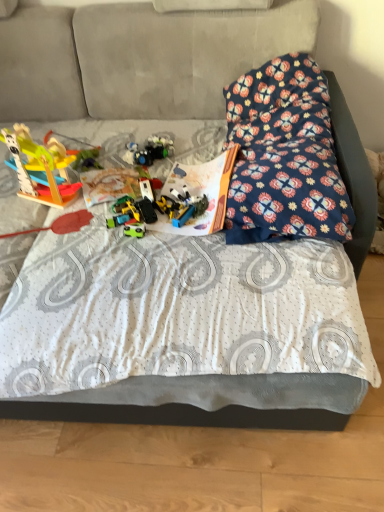
Question: Choose the correct answer: Is wooden toy at left, the first toy viewed from the left, inside plastic toy car at center, the sixth toy when ordered from left to right, or outside it?

Choices:
 (A) outside
 (B) inside

Answer: (A)

Question: Considering the positions of wooden toy at left, the first toy viewed from the left, and plastic toy car at center, the sixth toy when ordered from left to right, in the image, is wooden toy at left, the first toy viewed from the left, wider or thinner than plastic toy car at center, the sixth toy when ordered from left to right,?

Choices:
 (A) wide
 (B) thin

Answer: (B)

Question: Considering the real-world distances, which object is closest to the white textured sheet at center?

Choices:
 (A) plastic toy car at center, which is counted as the first toy, starting from the right
 (B) green plastic toy car at center, which is the 3th toy from right to left
 (C) floral fabric pillow at upper right
 (D) hardcover book at center
 (E) green plastic toy at center, which ranks as the second toy in left-to-right order

Answer: (D)

Question: Which of these objects is positioned farthest from the floral fabric pillow at upper right?

Choices:
 (A) green plastic toy car at center, which is the 3th toy from right to left
 (B) translucent plastic toys at center, acting as the 5th toy starting from the left
 (C) green plastic toy at center, placed as the 5th toy when sorted from right to left
 (D) wooden toy at left, which is the sixth toy in right-to-left order
 (E) white textured sheet at center

Answer: (D)